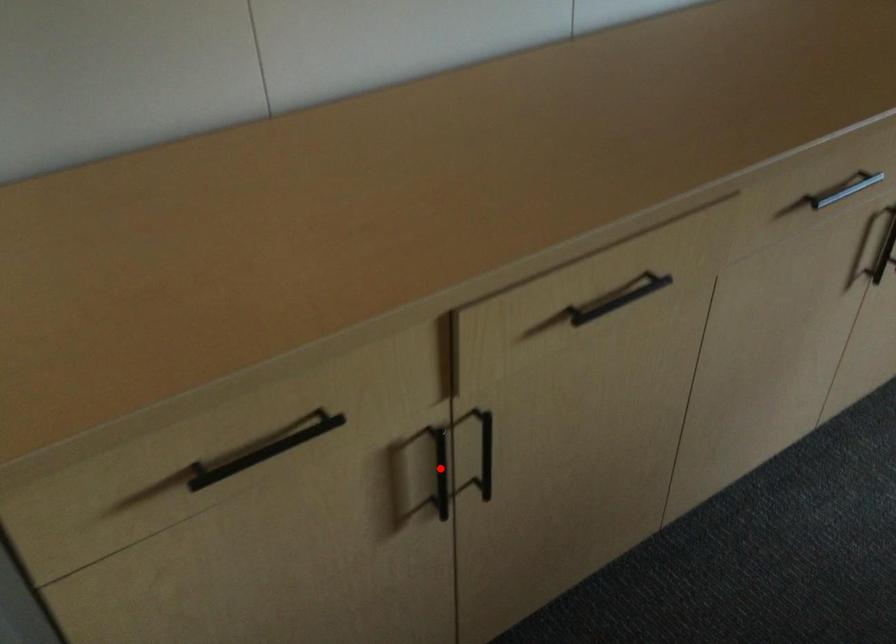
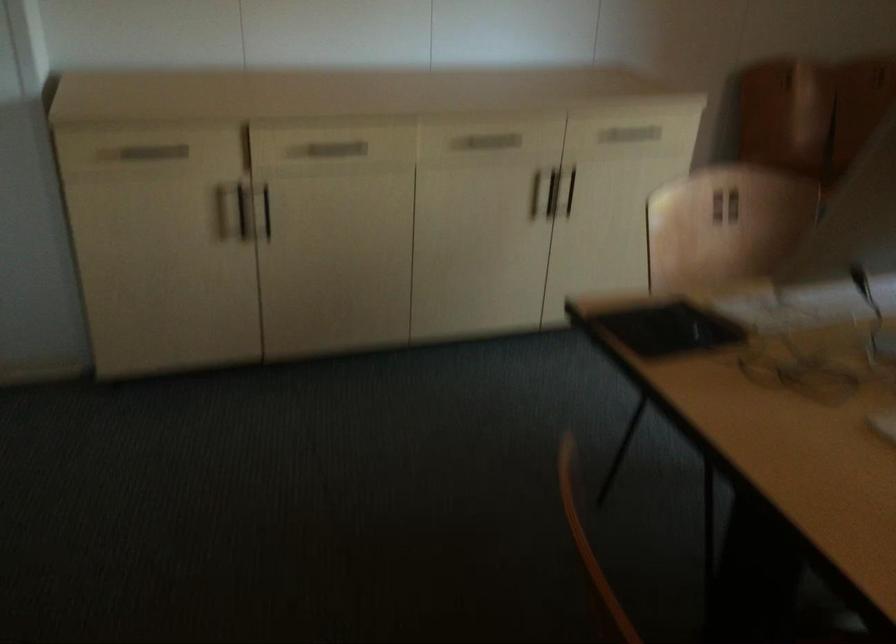
Question: I am providing you with two images of the same scene from different viewpoints. In image1, a red point is highlighted. Considering the same 3D point in image2, which of the following is correct?

Choices:
 (A) It is closer
 (B) It is farther

Answer: (B)